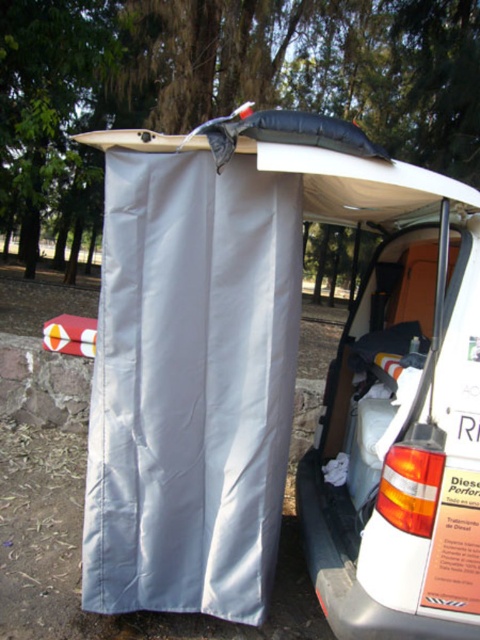
Which is in front, point (129, 458) or point (479, 195)?

Point (479, 195)

Looking at this image, who is taller, white fabric curtain at center or white foam surfboard at center?

white fabric curtain at center is taller.

Locate an element on the screen. This screenshot has width=480, height=640. white fabric curtain at center is located at coordinates (191, 385).